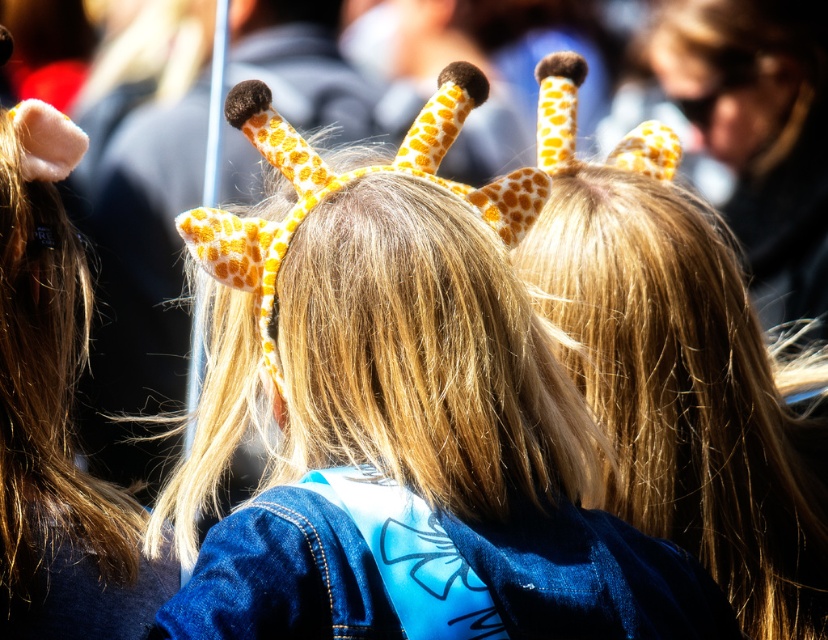
You are standing in a crowd and want to take a photo of the person wearing a giraffe headband. The camera you have can focus on objects up to 2 meters away. Is the point at coordinates point (440, 113) within the camera focus range?

The point at coordinates point (440, 113) is 1.82 meters from the viewer, which is within the camera focus range of up to 2 meters. Therefore, the camera can focus on that point.

You are a photographer standing at a distance of 5 feet from the matte yellow giraffe headband at center. You want to take a closeup shot of it. Is the current distance sufficient to capture the headband clearly in focus?

The matte yellow giraffe headband at center is 4.74 feet away from the camera. Since you are standing at 5 feet, which is slightly farther than the required distance, you might need to move closer to ensure the headband is in focus for a closeup shot.